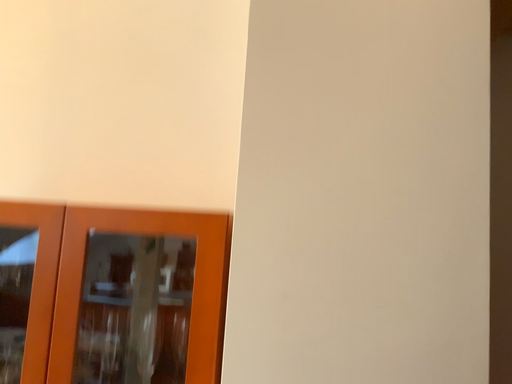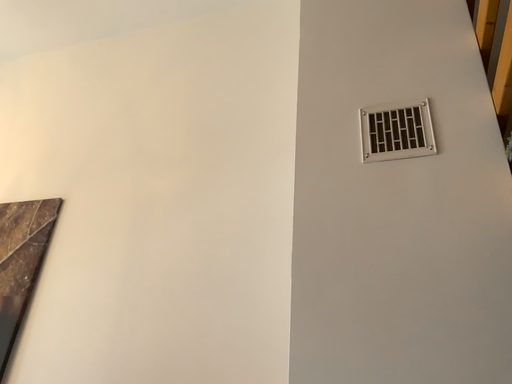
Question: Which way did the camera rotate in the video?

Choices:
 (A) rotated downward
 (B) rotated upward

Answer: (B)